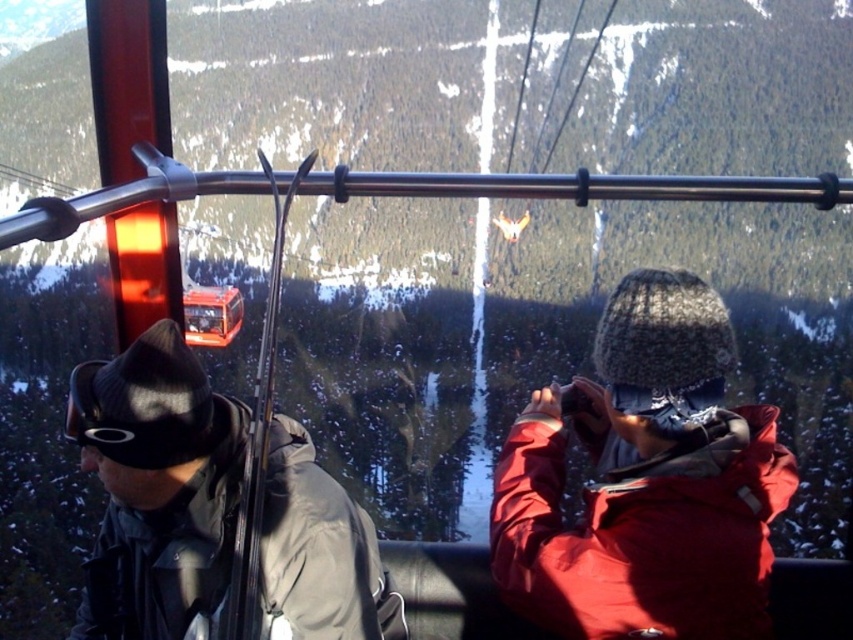
You are a photographer inside the cable car and want to take a clear photo of the matte black jacket at left without the gray matte jacket at left blocking it. What should you do?

The matte black jacket at left is in front of the gray matte jacket at left, so you should move the matte black jacket at left to the side or adjust your angle to avoid the gray matte jacket at left blocking the view.

In the scene shown: You are inside a cable car at a ski resort. You see two jackets on the left side of the cable car. The first is a matte black jacket at left and the second is a gray matte jacket at left. Which jacket is positioned higher up?

The matte black jacket at left is located above the gray matte jacket at left, so the matte black jacket at left is positioned higher up.

You are a photographer inside the cable car and want to ensure both the matte black jacket at left and the gray matte jacket at left are visible in your photo. Given their sizes, which jacket should you focus on to capture both without cropping?

The matte black jacket at left is larger than the gray matte jacket at left, so focusing on the matte black jacket at left would allow both to be visible in the photo as it occupies more space.